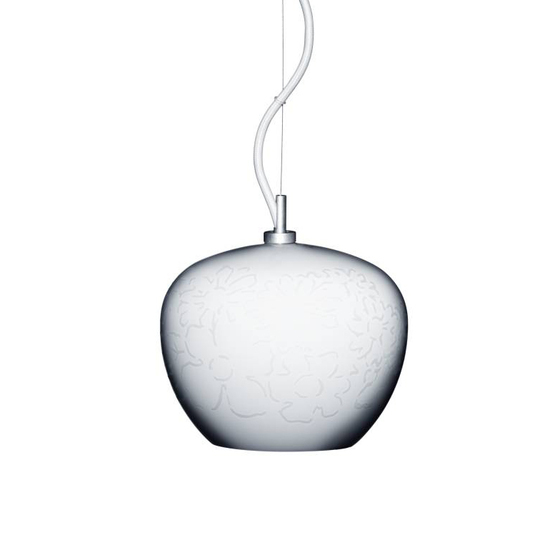
I want to click on bottom of lampshade, so click(x=283, y=449).